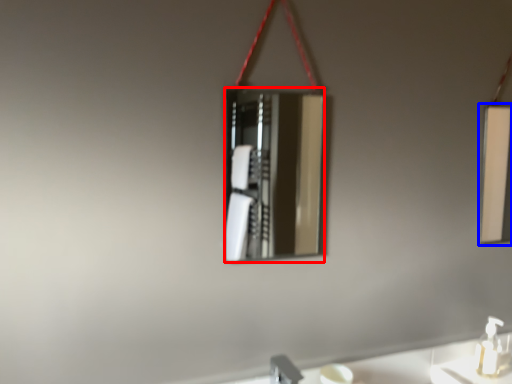
Question: Which point is closer to the camera, mirror (highlighted by a red box) or mirror (highlighted by a blue box)?

Choices:
 (A) mirror
 (B) mirror

Answer: (A)